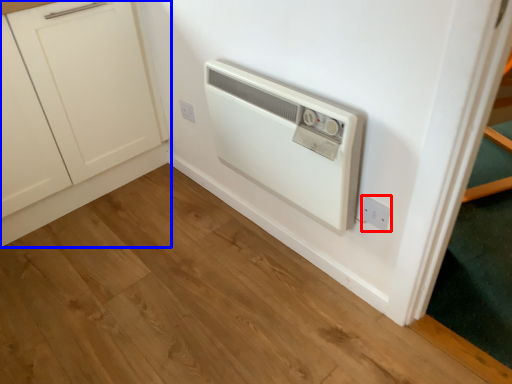
Question: Which point is further to the camera, electric outlet (highlighted by a red box) or cabinetry (highlighted by a blue box)?

Choices:
 (A) electric outlet
 (B) cabinetry

Answer: (A)